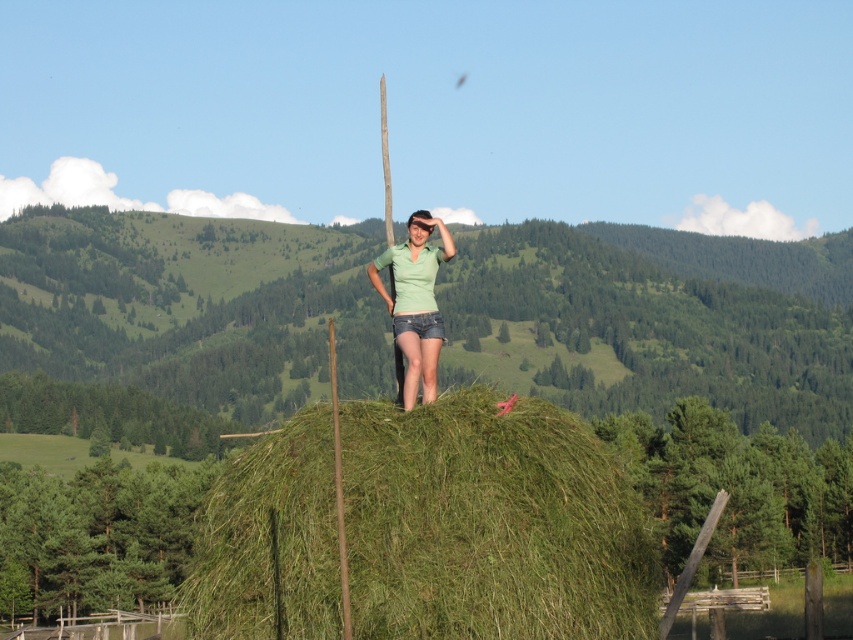
Looking at this image, you are a drone operator trying to capture a photo of the green grassy hay at center from above. Given that the hay bale is at coordinates point 0.820, 0.576, can you confirm if the hay bale is positioned closer to the top or bottom of the image?

The green grassy hay at center is located at point (490,524), which means it is positioned closer to the bottom of the image since the y coordinate is 0.576. In image coordinate systems, lower y values correspond to the top, so 0.576 places it below the center point.

You are a drone operator tasked with capturing aerial footage of the hay bale and the person standing on it. Your drone is currently hovering at point (490, 524). What is the immediate terrain directly beneath your drone?

The immediate terrain directly beneath the drone at point (490, 524) is green grassy hay at center.

You are a photographer planning to take a photo of the green grassy hay at center and the green denim shorts at center. Based on their heights, which object would appear larger in the photo?

The green grassy hay at center is taller than the green denim shorts at center, so it would appear larger in the photo.